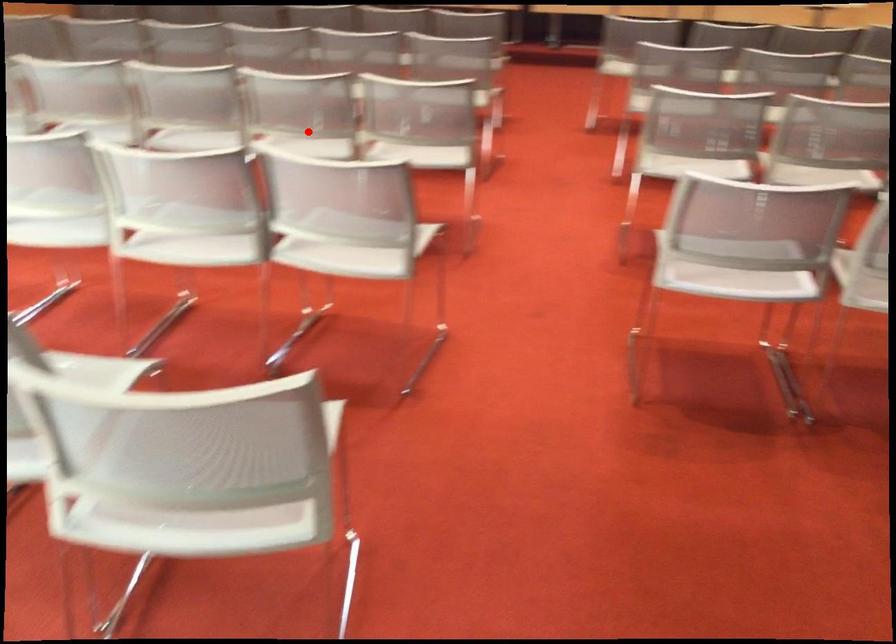
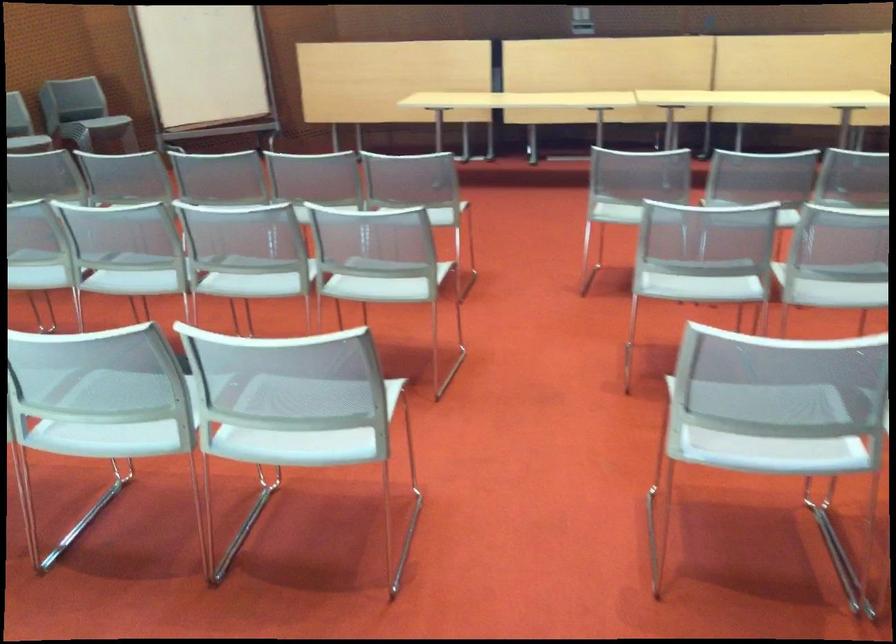
Question: I am providing you with two images of the same scene from different viewpoints. Image1 has a red point marked. In image2, the corresponding 3D location appears at what relative position? Reply with the corresponding letter.

Choices:
 (A) Closer
 (B) Farther

Answer: (A)